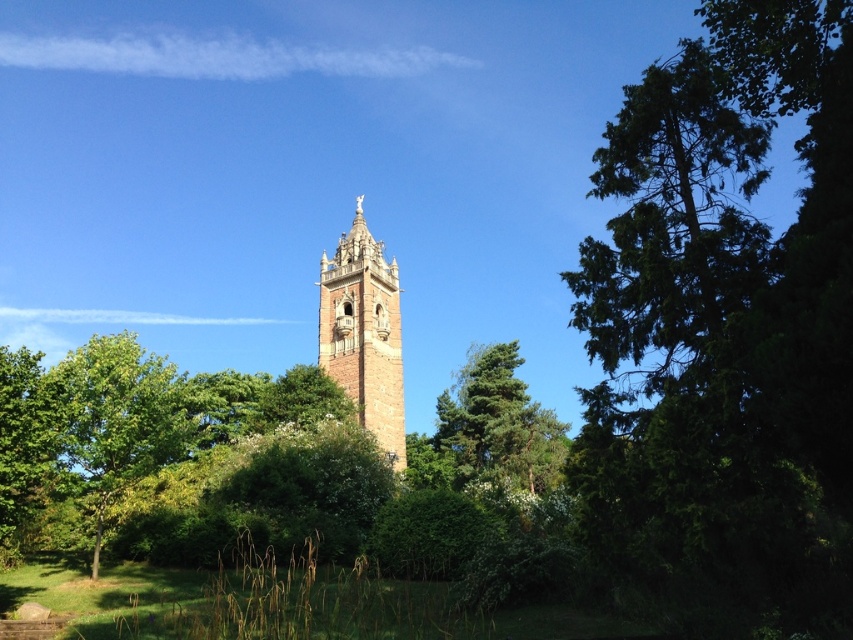
Question: Can you confirm if green leafy tree at left is thinner than green leafy bush at center?

Choices:
 (A) yes
 (B) no

Answer: (B)

Question: Where is green textured tree at center located in relation to green leafy tree at lower left in the image?

Choices:
 (A) below
 (B) above

Answer: (B)

Question: Which object is positioned closest to the green leafy tree at lower left?

Choices:
 (A) green leafy tree at left
 (B) green textured tree at center
 (C) brown stone tower at center

Answer: (A)

Question: Which point appears farthest from the camera in this image?

Choices:
 (A) pos(128,420)
 (B) pos(469,419)
 (C) pos(303,477)
 (D) pos(15,557)

Answer: (B)

Question: Does green textured tree at center appear on the left side of brown stone tower at center?

Choices:
 (A) no
 (B) yes

Answer: (A)

Question: Based on their relative distances, which object is farther from the green leafy tree at left?

Choices:
 (A) green textured tree at center
 (B) green leafy bush at center
 (C) brown stone tower at center
 (D) green leafy tree at lower left

Answer: (A)